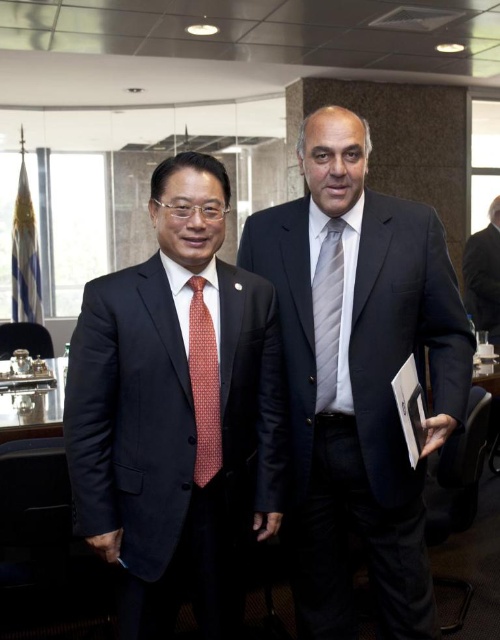
Question: Is red dotted tie at left to the right of gray striped tie at center from the viewer's perspective?

Choices:
 (A) yes
 (B) no

Answer: (B)

Question: Among these points, which one is nearest to the camera?

Choices:
 (A) (204, 317)
 (B) (193, 317)

Answer: (B)

Question: Among these points, which one is nearest to the camera?

Choices:
 (A) (253, 310)
 (B) (332, 304)

Answer: (A)

Question: Does matte black suit at center lie behind red dotted tie at left?

Choices:
 (A) yes
 (B) no

Answer: (B)

Question: Which of the following is the farthest from the observer?

Choices:
 (A) (216, 369)
 (B) (488, 301)

Answer: (B)

Question: Does matte black suit at center have a greater width compared to black suit at right?

Choices:
 (A) yes
 (B) no

Answer: (A)